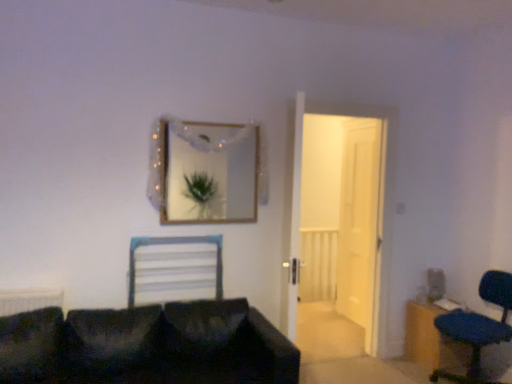
Question: Is wooden dresser at lower right aimed at white glossy door at center, which is the 1th door in front-to-back order?

Choices:
 (A) yes
 (B) no

Answer: (B)

Question: Is wooden dresser at lower right shorter than white glossy door at center, which is the 1th door in front-to-back order?

Choices:
 (A) no
 (B) yes

Answer: (B)

Question: Is wooden dresser at lower right not near white glossy door at center, which is the 1th door in front-to-back order?

Choices:
 (A) no
 (B) yes

Answer: (A)

Question: Is wooden dresser at lower right bigger than white glossy door at center, the second door when ordered from back to front?

Choices:
 (A) yes
 (B) no

Answer: (B)

Question: Is white glossy door at center, which is the 1th door in front-to-back order, completely or partially inside wooden dresser at lower right?

Choices:
 (A) yes
 (B) no

Answer: (B)

Question: Is wooden dresser at lower right wider than white glossy door at center, which is the 1th door in front-to-back order?

Choices:
 (A) yes
 (B) no

Answer: (A)

Question: Is translucent plastic curtain at upper center aimed at white glossy door at center, the second door when ordered from back to front?

Choices:
 (A) no
 (B) yes

Answer: (A)

Question: Is translucent plastic curtain at upper center not near white glossy door at center, which is the 1th door in front-to-back order?

Choices:
 (A) no
 (B) yes

Answer: (B)

Question: Is translucent plastic curtain at upper center positioned beyond the bounds of white glossy door at center, the second door when ordered from back to front?

Choices:
 (A) no
 (B) yes

Answer: (B)

Question: Is translucent plastic curtain at upper center at the right side of white glossy door at center, which is the 1th door in front-to-back order?

Choices:
 (A) no
 (B) yes

Answer: (A)

Question: Does translucent plastic curtain at upper center have a larger size compared to white glossy door at center, which is the 1th door in front-to-back order?

Choices:
 (A) yes
 (B) no

Answer: (B)

Question: Considering the relative sizes of translucent plastic curtain at upper center and white glossy door at center, the second door when ordered from back to front, in the image provided, is translucent plastic curtain at upper center shorter than white glossy door at center, the second door when ordered from back to front,?

Choices:
 (A) no
 (B) yes

Answer: (B)

Question: Is blue fabric chair at lower right to the left of gold-framed mirror at upper center from the viewer's perspective?

Choices:
 (A) no
 (B) yes

Answer: (A)